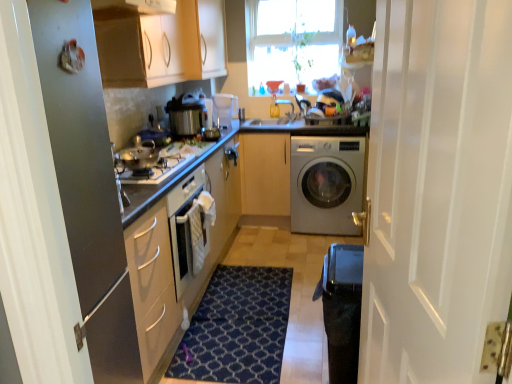
Question: Is translucent glass coffee cup at upper center to the left of matte white cabinet at upper center, the first cabinetry viewed from the left, from the viewer's perspective?

Choices:
 (A) no
 (B) yes

Answer: (A)

Question: From a real-world perspective, is translucent glass coffee cup at upper center beneath matte white cabinet at upper center, the first cabinetry viewed from the left?

Choices:
 (A) no
 (B) yes

Answer: (B)

Question: Is translucent glass coffee cup at upper center placed right next to matte white cabinet at upper center, the first cabinetry viewed from the left?

Choices:
 (A) no
 (B) yes

Answer: (A)

Question: Considering the relative sizes of translucent glass coffee cup at upper center and matte white cabinet at upper center, the 2th cabinetry when ordered from bottom to top, in the image provided, is translucent glass coffee cup at upper center wider than matte white cabinet at upper center, the 2th cabinetry when ordered from bottom to top,?

Choices:
 (A) no
 (B) yes

Answer: (A)

Question: Considering the relative positions of translucent glass coffee cup at upper center and matte white cabinet at upper center, which is the 1th cabinetry from top to bottom, in the image provided, is translucent glass coffee cup at upper center to the right of matte white cabinet at upper center, which is the 1th cabinetry from top to bottom, from the viewer's perspective?

Choices:
 (A) yes
 (B) no

Answer: (A)

Question: Is translucent glass coffee cup at upper center turned away from matte white cabinet at upper center, which is counted as the second cabinetry, starting from the right?

Choices:
 (A) no
 (B) yes

Answer: (A)

Question: Is light wood/texture cabinet at center, which is counted as the first cabinetry, starting from the right, positioned far away from metallic silver pot at center, marked as the 1th appliance in a top-to-bottom arrangement?

Choices:
 (A) no
 (B) yes

Answer: (A)

Question: Can you confirm if light wood/texture cabinet at center, acting as the 2th cabinetry starting from the left, is bigger than metallic silver pot at center, which ranks as the 2th appliance in bottom-to-top order?

Choices:
 (A) no
 (B) yes

Answer: (B)

Question: Is light wood/texture cabinet at center, which is counted as the first cabinetry, starting from the right, oriented away from metallic silver pot at center, placed as the 1th appliance when sorted from right to left?

Choices:
 (A) yes
 (B) no

Answer: (B)

Question: From a real-world perspective, does light wood/texture cabinet at center, marked as the first cabinetry in a bottom-to-top arrangement, stand above metallic silver pot at center, marked as the 1th appliance in a top-to-bottom arrangement?

Choices:
 (A) no
 (B) yes

Answer: (A)

Question: Is light wood/texture cabinet at center, the 2th cabinetry positioned from the top, shorter than metallic silver pot at center, which is counted as the 2th appliance, starting from the left?

Choices:
 (A) no
 (B) yes

Answer: (A)

Question: Does light wood/texture cabinet at center, marked as the first cabinetry in a bottom-to-top arrangement, contain metallic silver pot at center, which is counted as the 2th appliance, starting from the left?

Choices:
 (A) no
 (B) yes

Answer: (A)

Question: Is white glossy washing machine at center facing towards black textured water heater at lower right?

Choices:
 (A) no
 (B) yes

Answer: (B)